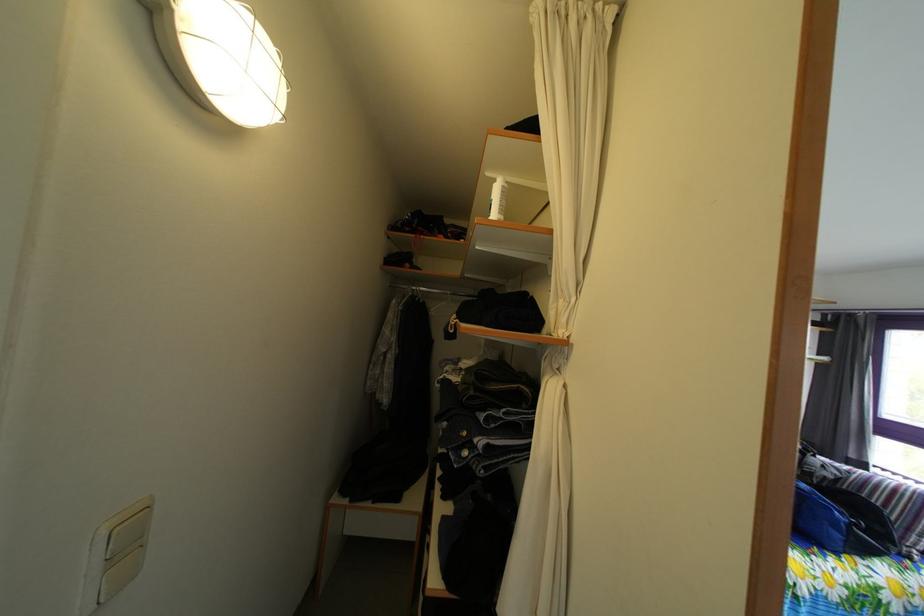
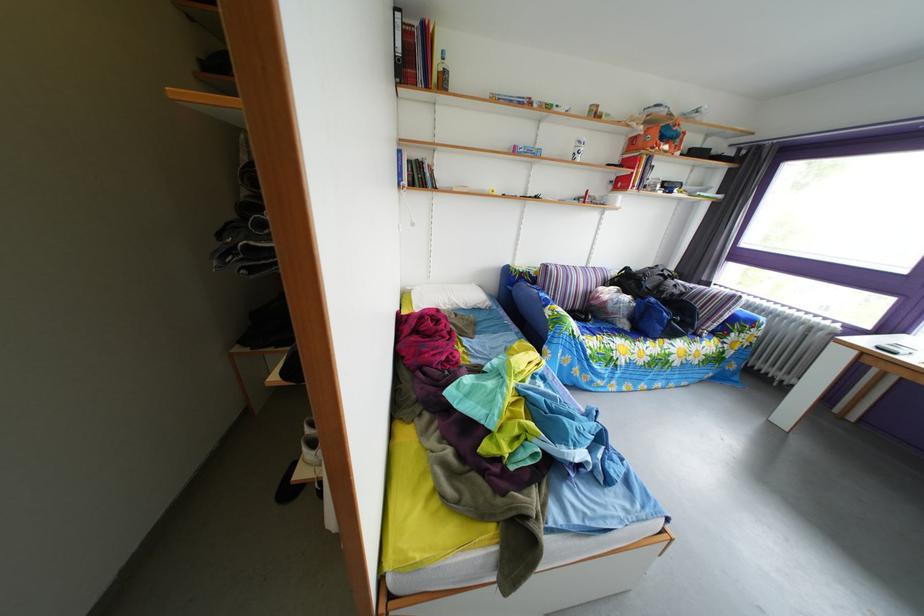
Find the pixel in the second image that matches [815,493] in the first image.

(663, 307)